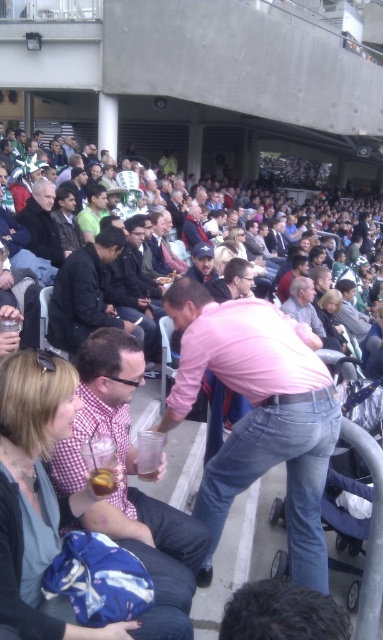
You are attending a sports event and want to locate two jackets in the crowd. The dark blue jacket at center and the dark brown leather jacket at upper left are both visible. Which jacket is located higher up in the seating area?

The dark brown leather jacket at upper left is higher up in the seating area because it is positioned above the dark blue jacket at center.

You are organizing a clothing donation drive and need to determine which item takes up more space in a storage box. Based on the scene, which item between the checkered fabric shirt at center and the dark blue jacket at center is wider?

The checkered fabric shirt at center is less wide than the dark blue jacket at center, so the dark blue jacket at center takes up more space in the storage box.

You are standing at the point labeled point (32, 212) and want to move to the point labeled point (70, 340). Given that you can only move forward in a straight line, will you be moving towards or away from the crowd of spectators?

Moving from point (32, 212) to point (70, 340) would mean moving away from the crowd of spectators since point (70, 340) is closer to the viewer than point (32, 212). Since the crowd is part of the background in the stadium setting, moving towards the latter point would take you closer to the front, away from the seated spectators.